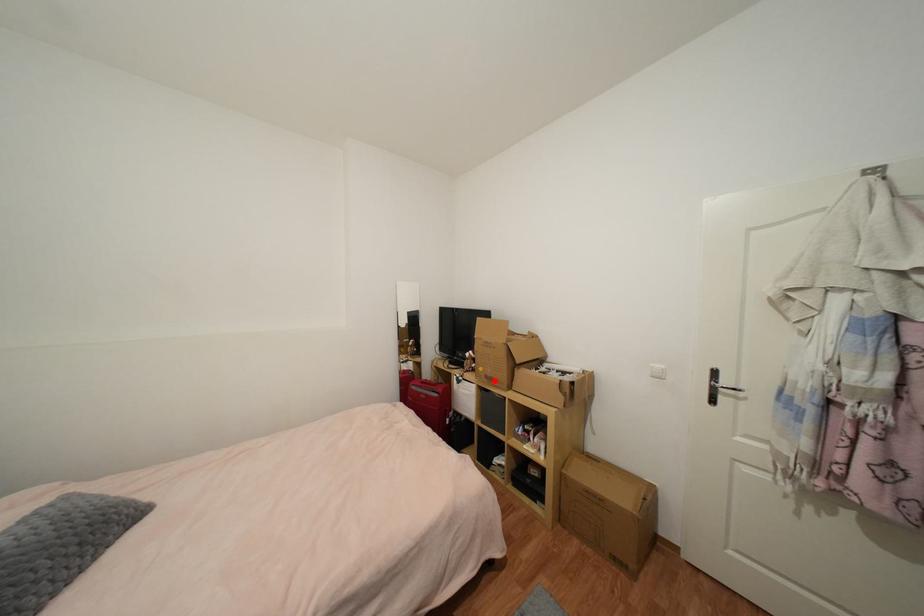
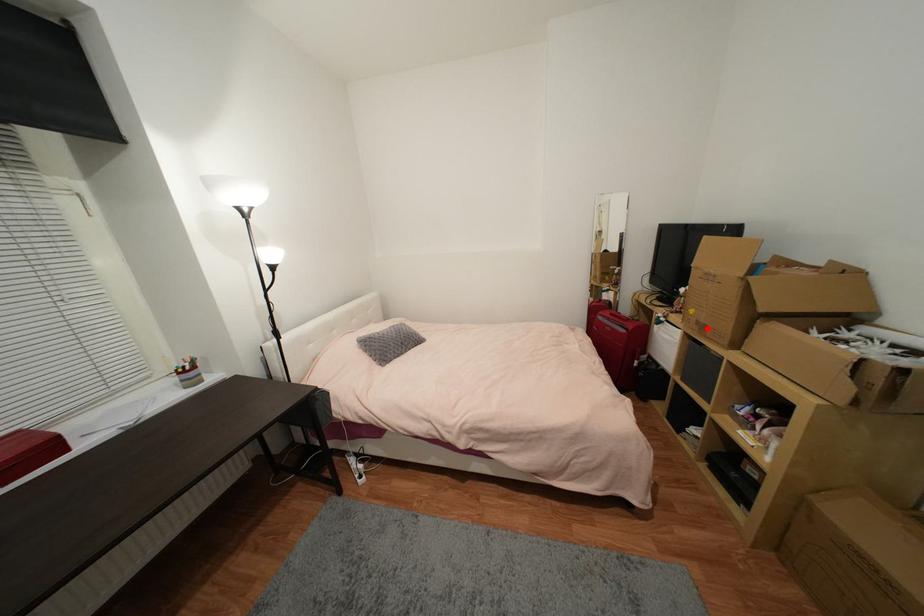
I am providing you with two images of the same scene from different viewpoints. A red point is marked on the first image and another point is marked on the second image. Do the highlighted points in image1 and image2 indicate the same real-world spot?

Yes